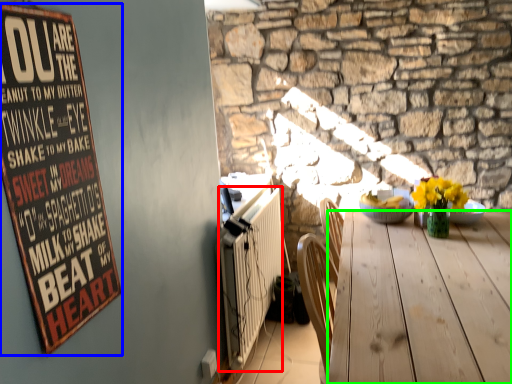
Question: Which object is the closest to the radiator (highlighted by a red box)? Choose among these: bulletin board (highlighted by a blue box) or desk (highlighted by a green box).

Choices:
 (A) bulletin board
 (B) desk

Answer: (B)